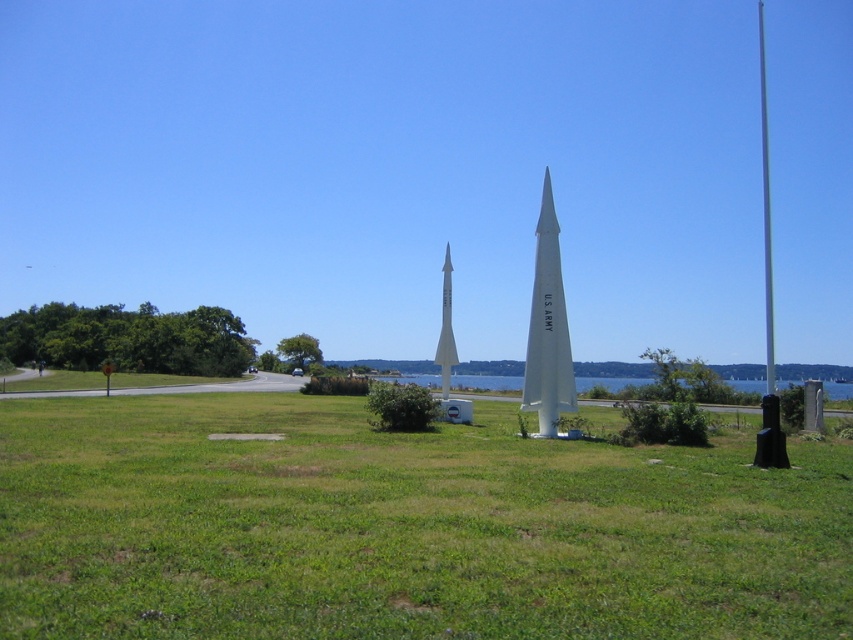
You are standing at point A at point [218,504] and want to walk to point B, which is 8.34 meters away. Given the open grassy area and clear path, will you be able to walk directly to point B without obstacles?

Yes, since the open grassy area has a clear path and no obstacles mentioned, you can walk directly to point B which is 8.34 meters away from point A at point [218,504].

You are a visitor standing at the entrance of the memorial area. You see the white matte us army missile at center and the silver metallic flag pole at right. Which object is closer to the sky?

The silver metallic flag pole at right is closer to the sky because the white matte us army missile at center is positioned under it.

You are standing in the open grassy area looking at the two rockets. Which of the two points, point (563, 296) or point (762, 54), appears closer to you?

Point (563, 296) is closer to the camera than point (762, 54), so it appears closer to you.